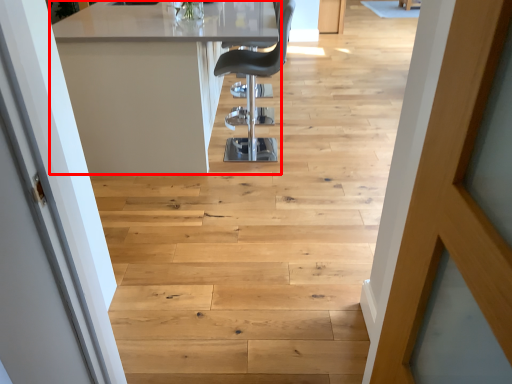
Question: From the image's perspective, what is the correct spatial relationship of table (annotated by the red box) in relation to chair?

Choices:
 (A) below
 (B) above

Answer: (B)